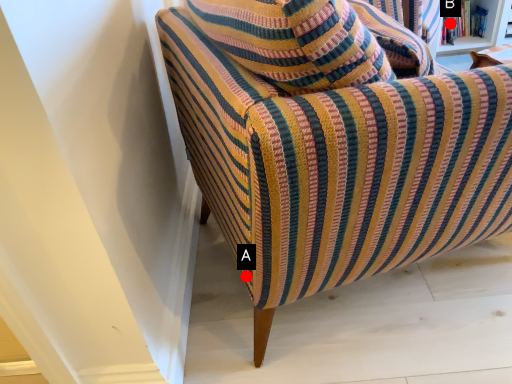
Question: Two points are circled on the image, labeled by A and B beside each circle. Which point is closer to the camera taking this photo?

Choices:
 (A) A is closer
 (B) B is closer

Answer: (A)